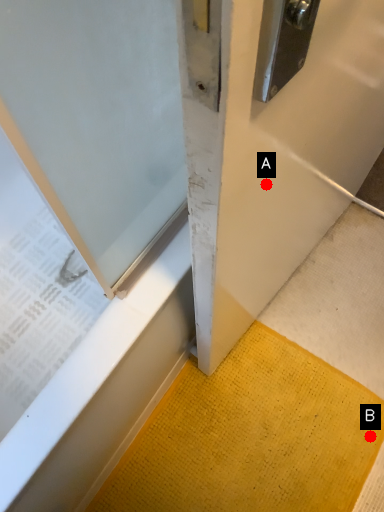
Question: Two points are circled on the image, labeled by A and B beside each circle. Which of the following is the farthest from the observer?

Choices:
 (A) A is further
 (B) B is further

Answer: (B)